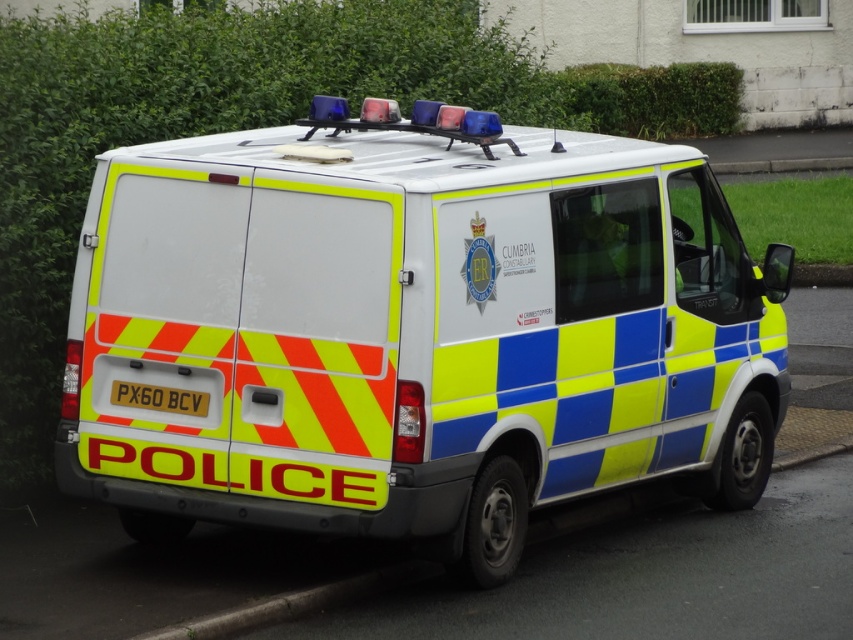
You are a pedestrian standing on the sidewalk and see the reflective plastic police van at center and the yellow reflective plastic at rear. Which object is positioned higher from the ground?

The reflective plastic police van at center is positioned higher from the ground than the yellow reflective plastic at rear.

You are standing at a point 6.92 meters away from the point marked at coordinates point (486, 547). Given that the police van is parked on the street, can you estimate whether you are positioned in front of or behind the police van?

The point marked at coordinates point (486, 547) is located on the rear of the police van. Since you are 6.92 meters away from this point, you are positioned in front of the police van.

You are standing at the intersection and see the reflective plastic police van at center. If you walk directly towards the van, will you first encounter its front or back side?

The reflective plastic police van at center is positioned such that its front faces away from you, so you would first encounter its back side when walking directly towards it.